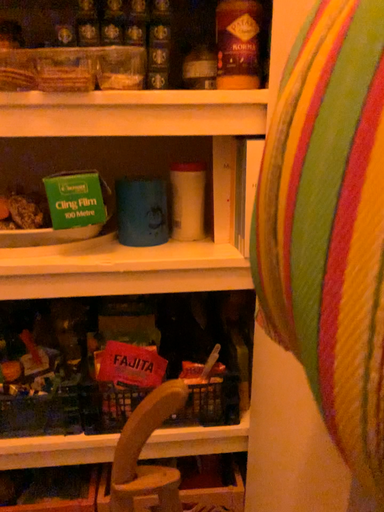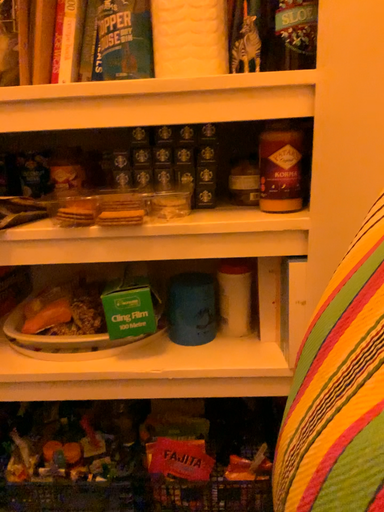
Question: How did the camera likely rotate when shooting the video?

Choices:
 (A) rotated left
 (B) rotated right

Answer: (A)